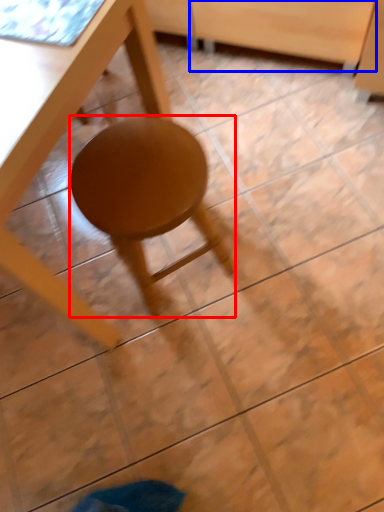
Question: Which object appears closest to the camera in this image, stool (highlighted by a red box) or drawer (highlighted by a blue box)?

Choices:
 (A) stool
 (B) drawer

Answer: (A)